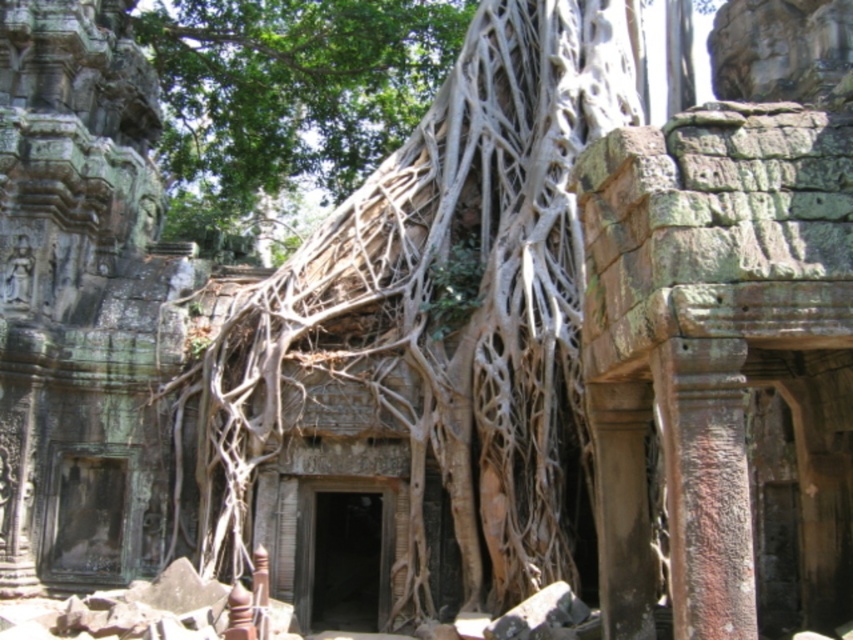
You are an archaeologist examining the ancient temple structure. You notice the brown textured roots at center and the gray stone carving at left. Which object has a greater height in this scene?

The brown textured roots at center is taller than the gray stone carving at left.

You are an archaeologist examining the ancient temple. You notice the brown textured roots at center and the gray stone carving at left. Which object is located to the right of the other?

The brown textured roots at center is positioned on the right side of gray stone carving at left.

Consider the image. You are an archaeologist examining the temple structure. You notice the brown textured roots at center and the gray stone carving at left. Which object has a greater width?

The brown textured roots at center has a greater width than the gray stone carving at left.